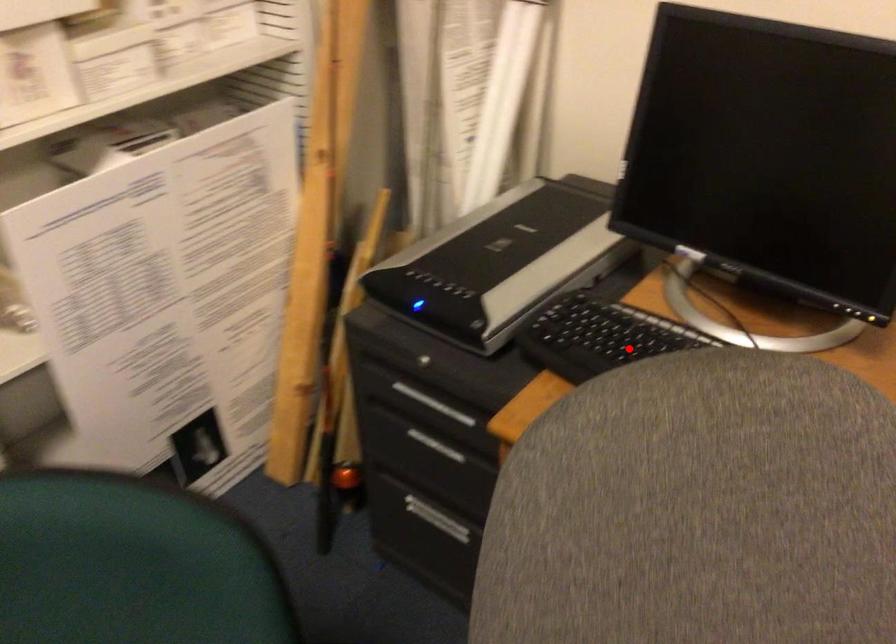
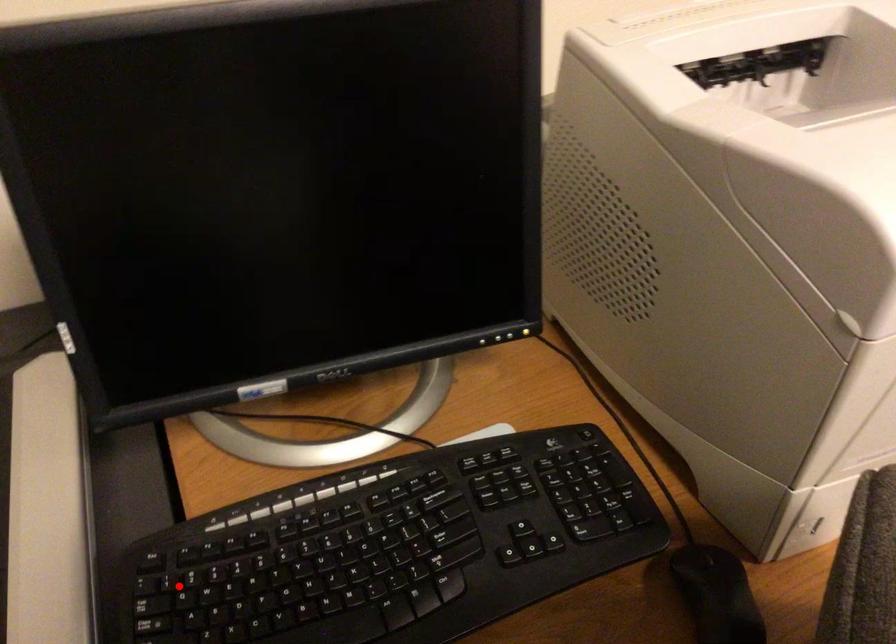
I am providing you with two images of the same scene from different viewpoints. A red point is marked on the first image and another point is marked on the second image. Is the red point in image1 aligned with the point shown in image2?

No